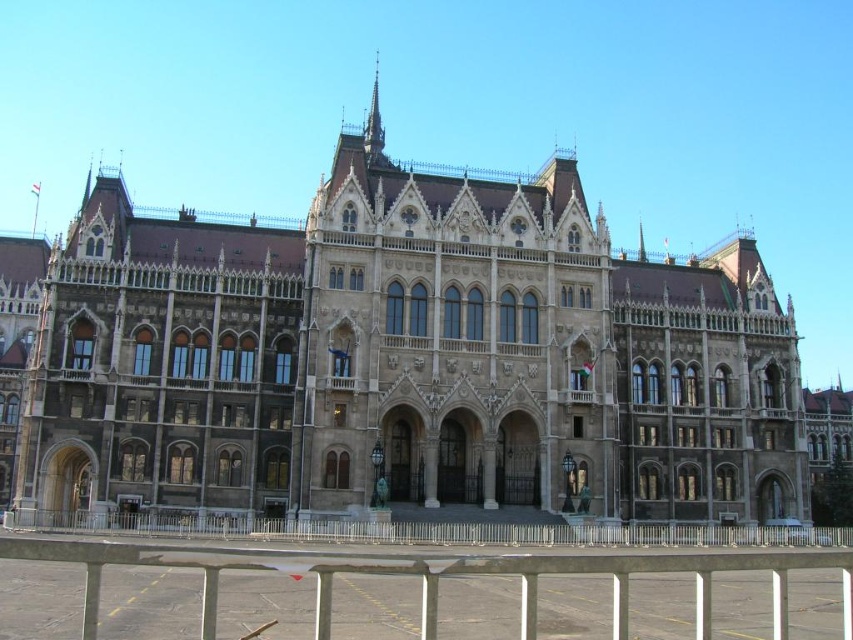
You are a visitor standing at the entrance of the historic building. You see the metallic silver rail at lower center and the metallic silver fence at lower center. Which one is taller?

The metallic silver rail at lower center is taller than the metallic silver fence at lower center.

You are a tour guide explaining the architectural details of the historic building. You point out the metallic silver rail at lower center and the metallic silver fence at lower center. Which one is narrower?

The metallic silver rail at lower center is narrower than the metallic silver fence at lower center.